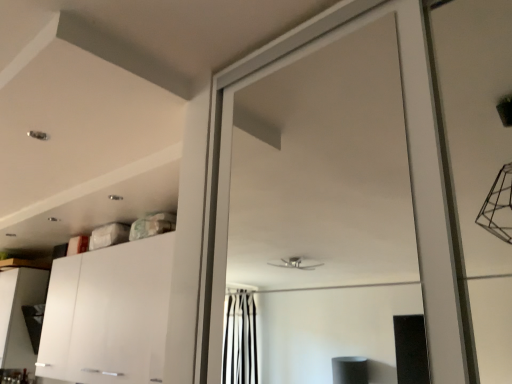
At what (x,y) coordinates should I click in order to perform the action: click on white glossy cabinet at lower left, which is the first cabinetry from right to left. Please return your answer as a coordinate pair (x, y). Looking at the image, I should click on (108, 314).

Image resolution: width=512 pixels, height=384 pixels. Describe the element at coordinates (108, 314) in the screenshot. I see `white glossy cabinet at lower left, which is the first cabinetry from right to left` at that location.

Based on the photo, measure the distance between point (106, 332) and camera.

The distance of point (106, 332) from camera is 7.20 feet.

Locate an element on the screen. white glossy cabinet at lower left, the 1th cabinetry viewed from the back is located at coordinates (19, 314).

Describe the element at coordinates (19, 314) in the screenshot. The height and width of the screenshot is (384, 512). I see `white glossy cabinet at lower left, the second cabinetry when ordered from front to back` at that location.

Where is `white glossy cabinet at lower left, the first cabinetry positioned from the front`? This screenshot has height=384, width=512. white glossy cabinet at lower left, the first cabinetry positioned from the front is located at coordinates (108, 314).

Which object is positioned more to the left, white glossy cabinet at lower left, the second cabinetry when ordered from front to back, or white glossy cabinet at lower left, which is the second cabinetry from left to right?

white glossy cabinet at lower left, the second cabinetry when ordered from front to back.

Which object is closer to the camera, white glossy cabinet at lower left, the 1th cabinetry viewed from the back, or white glossy cabinet at lower left, the first cabinetry positioned from the front?

white glossy cabinet at lower left, the first cabinetry positioned from the front, is closer to the camera.

Does point (31, 371) come closer to viewer compared to point (102, 279)?

No, (31, 371) is further to viewer.

From the image's perspective, is white glossy cabinet at lower left, the 1th cabinetry viewed from the back, positioned above or below white glossy cabinet at lower left, placed as the second cabinetry when sorted from back to front?

From the image's perspective, white glossy cabinet at lower left, the 1th cabinetry viewed from the back, appears below white glossy cabinet at lower left, placed as the second cabinetry when sorted from back to front.

From a real-world perspective, which is physically below, white glossy cabinet at lower left, the second cabinetry when ordered from right to left, or white glossy cabinet at lower left, the first cabinetry positioned from the front?

white glossy cabinet at lower left, the second cabinetry when ordered from right to left, is physically lower.

Which object is thinner, white glossy cabinet at lower left, the 1th cabinetry viewed from the left, or white glossy cabinet at lower left, which is the first cabinetry from right to left?

white glossy cabinet at lower left, which is the first cabinetry from right to left, is thinner.

From their relative heights in the image, would you say white glossy cabinet at lower left, the 1th cabinetry viewed from the left, is taller or shorter than white glossy cabinet at lower left, which is the second cabinetry from left to right?

Considering their sizes, white glossy cabinet at lower left, the 1th cabinetry viewed from the left, has less height than white glossy cabinet at lower left, which is the second cabinetry from left to right.

Which of these two, white glossy cabinet at lower left, the second cabinetry when ordered from front to back, or white glossy cabinet at lower left, placed as the second cabinetry when sorted from back to front, is bigger?

Bigger between the two is white glossy cabinet at lower left, placed as the second cabinetry when sorted from back to front.

Is white glossy cabinet at lower left, the 1th cabinetry viewed from the back, not within white glossy cabinet at lower left, which is the first cabinetry from right to left?

Yes, white glossy cabinet at lower left, the 1th cabinetry viewed from the back, is located beyond the bounds of white glossy cabinet at lower left, which is the first cabinetry from right to left.

Is white glossy cabinet at lower left, the 1th cabinetry viewed from the left, positioned far away from white glossy cabinet at lower left, the first cabinetry positioned from the front?

They are positioned close to each other.

Is white glossy cabinet at lower left, the 1th cabinetry viewed from the left, turned away from white glossy cabinet at lower left, which is the second cabinetry from left to right?

No.

What's the angular difference between white glossy cabinet at lower left, the second cabinetry when ordered from right to left, and white glossy cabinet at lower left, which is the second cabinetry from left to right,'s facing directions?

1.66 degrees separate the facing orientations of white glossy cabinet at lower left, the second cabinetry when ordered from right to left, and white glossy cabinet at lower left, which is the second cabinetry from left to right.

I want to click on cabinetry in front of the white glossy cabinet at lower left, the 1th cabinetry viewed from the left, so click(108, 314).

Which is more to the left, white glossy cabinet at lower left, which is the second cabinetry from left to right, or white glossy cabinet at lower left, the second cabinetry when ordered from front to back?

white glossy cabinet at lower left, the second cabinetry when ordered from front to back, is more to the left.

Is white glossy cabinet at lower left, the first cabinetry positioned from the front, positioned in front of white glossy cabinet at lower left, the second cabinetry when ordered from front to back?

That is True.

Which is behind, point (89, 288) or point (2, 362)?

The point (2, 362) is farther.

From the image's perspective, would you say white glossy cabinet at lower left, which is the first cabinetry from right to left, is positioned over white glossy cabinet at lower left, the 1th cabinetry viewed from the back?

Yes, from the image's perspective, white glossy cabinet at lower left, which is the first cabinetry from right to left, is on top of white glossy cabinet at lower left, the 1th cabinetry viewed from the back.

From a real-world perspective, is white glossy cabinet at lower left, which is the first cabinetry from right to left, located higher than white glossy cabinet at lower left, the 1th cabinetry viewed from the left?

Correct, in the physical world, white glossy cabinet at lower left, which is the first cabinetry from right to left, is higher than white glossy cabinet at lower left, the 1th cabinetry viewed from the left.

Looking at their sizes, would you say white glossy cabinet at lower left, the first cabinetry positioned from the front, is wider or thinner than white glossy cabinet at lower left, the second cabinetry when ordered from right to left?

In the image, white glossy cabinet at lower left, the first cabinetry positioned from the front, appears to be more narrow than white glossy cabinet at lower left, the second cabinetry when ordered from right to left.

Considering the sizes of white glossy cabinet at lower left, placed as the second cabinetry when sorted from back to front, and white glossy cabinet at lower left, the 1th cabinetry viewed from the back, in the image, is white glossy cabinet at lower left, placed as the second cabinetry when sorted from back to front, taller or shorter than white glossy cabinet at lower left, the 1th cabinetry viewed from the back,?

In the image, white glossy cabinet at lower left, placed as the second cabinetry when sorted from back to front, appears to be taller than white glossy cabinet at lower left, the 1th cabinetry viewed from the back.

Looking at the image, does white glossy cabinet at lower left, placed as the second cabinetry when sorted from back to front, seem bigger or smaller compared to white glossy cabinet at lower left, the 1th cabinetry viewed from the left?

Clearly, white glossy cabinet at lower left, placed as the second cabinetry when sorted from back to front, is larger in size than white glossy cabinet at lower left, the 1th cabinetry viewed from the left.

Can we say white glossy cabinet at lower left, the first cabinetry positioned from the front, lies outside white glossy cabinet at lower left, the 1th cabinetry viewed from the back?

Yes, white glossy cabinet at lower left, the first cabinetry positioned from the front, is not within white glossy cabinet at lower left, the 1th cabinetry viewed from the back.

Is white glossy cabinet at lower left, which is the second cabinetry from left to right, not near white glossy cabinet at lower left, the second cabinetry when ordered from right to left?

That's not correct — white glossy cabinet at lower left, which is the second cabinetry from left to right, is a little close to white glossy cabinet at lower left, the second cabinetry when ordered from right to left.

Could you tell me if white glossy cabinet at lower left, placed as the second cabinetry when sorted from back to front, is turned towards white glossy cabinet at lower left, the 1th cabinetry viewed from the back?

No, white glossy cabinet at lower left, placed as the second cabinetry when sorted from back to front, is not aimed at white glossy cabinet at lower left, the 1th cabinetry viewed from the back.

How many degrees apart are the facing directions of white glossy cabinet at lower left, placed as the second cabinetry when sorted from back to front, and white glossy cabinet at lower left, the second cabinetry when ordered from front to back?

The angle between the facing direction of white glossy cabinet at lower left, placed as the second cabinetry when sorted from back to front, and the facing direction of white glossy cabinet at lower left, the second cabinetry when ordered from front to back, is 1.66 degrees.

I want to click on cabinetry that is behind the white glossy cabinet at lower left, placed as the second cabinetry when sorted from back to front, so click(x=19, y=314).

The width and height of the screenshot is (512, 384). I want to click on cabinetry to the left of white glossy cabinet at lower left, which is the second cabinetry from left to right, so click(x=19, y=314).

Identify the location of cabinetry below the white glossy cabinet at lower left, which is the second cabinetry from left to right (from the image's perspective). This screenshot has width=512, height=384. (19, 314).